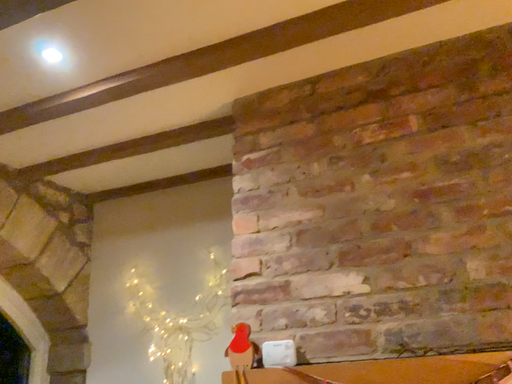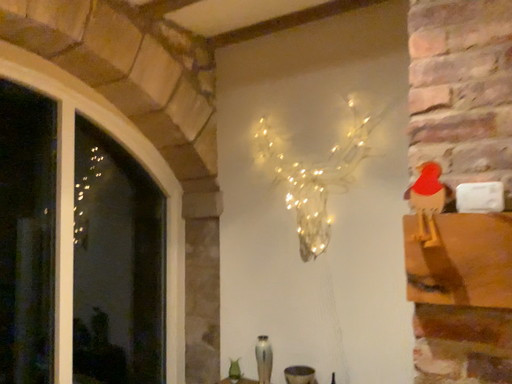
Question: Which way did the camera rotate in the video?

Choices:
 (A) rotated upward
 (B) rotated downward

Answer: (B)